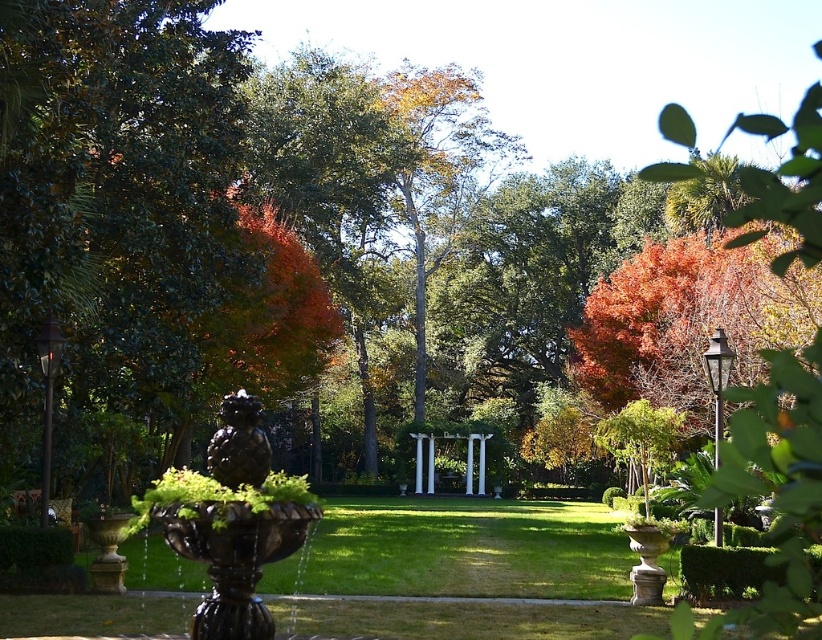
You are standing at the fountain in the foreground of the garden. You see two points marked in the scene. Which point is closer to you, point (x=128, y=365) or point (x=293, y=257)?

Point (x=128, y=365) is in front of point (x=293, y=257), so it is closer to you.